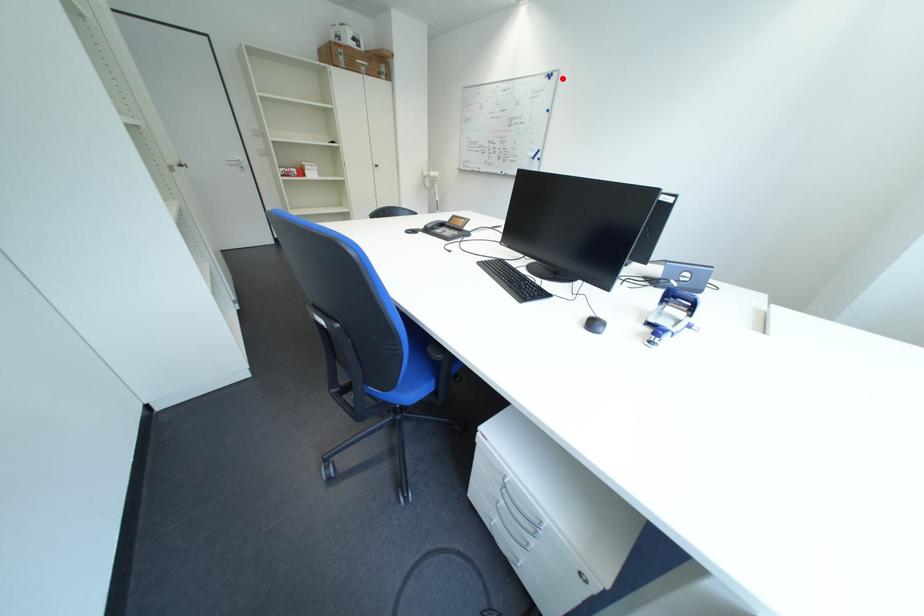
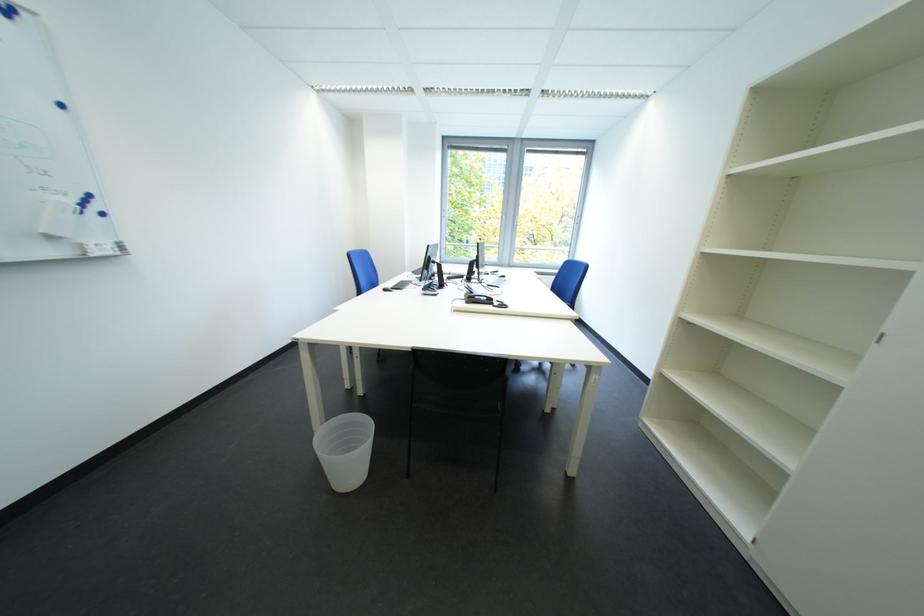
In the second image, find the point that corresponds to the highlighted location in the first image.

(17, 12)